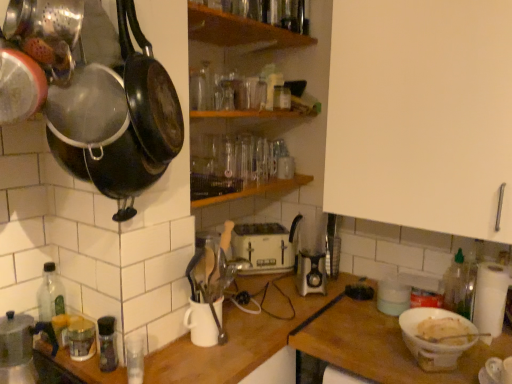
Identify the location of free space behind clear glass bottle at lower left, marked as the 2th bottle in a right-to-left arrangement. (165, 349).